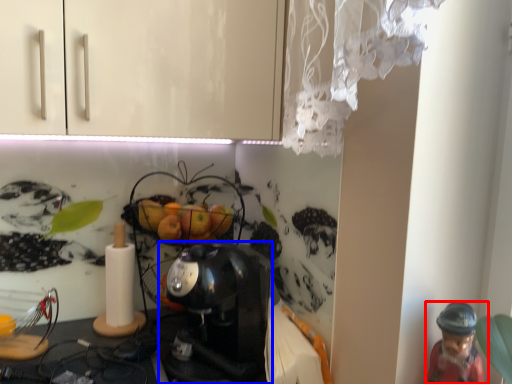
Question: Which object is further to the camera taking this photo, person (highlighted by a red box) or coffee maker (highlighted by a blue box)?

Choices:
 (A) person
 (B) coffee maker

Answer: (B)